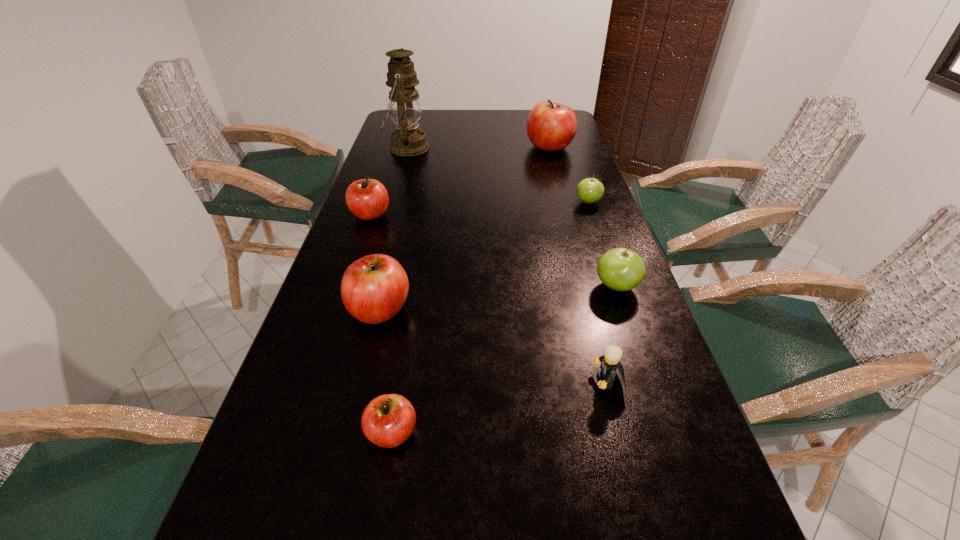
At what (x,y) coordinates should I click in order to perform the action: click on free spot between the Lego and the second smallest red apple. Please return your answer as a coordinate pair (x, y). Looking at the image, I should click on (x=489, y=298).

This screenshot has width=960, height=540. Find the location of `free spot between the oil lamp and the second farthest red apple`. free spot between the oil lamp and the second farthest red apple is located at coordinates (389, 181).

The height and width of the screenshot is (540, 960). In order to click on free spot between the Lego and the smallest red apple in this screenshot , I will do `click(500, 407)`.

Where is `free spot between the farther green apple and the rightmost red apple`? free spot between the farther green apple and the rightmost red apple is located at coordinates (568, 174).

Identify which object is the second closest to the third nearest red apple. Please provide its 2D coordinates. Your answer should be formatted as a tuple, i.e. [(x, y)], where the tuple contains the x and y coordinates of a point satisfying the conditions above.

[(404, 102)]

This screenshot has height=540, width=960. I want to click on the fifth closest object to the nearer green apple, so click(x=367, y=199).

At what (x,y) coordinates should I click in order to perform the action: click on apple that is the closest to the green oil lamp. Please return your answer as a coordinate pair (x, y). Looking at the image, I should click on (367, 199).

Select which apple appears as the second closest to the fifth shortest apple. Please provide its 2D coordinates. Your answer should be formatted as a tuple, i.e. [(x, y)], where the tuple contains the x and y coordinates of a point satisfying the conditions above.

[(367, 199)]

Point out which red apple is positioned as the nearest to the oil lamp. Please provide its 2D coordinates. Your answer should be formatted as a tuple, i.e. [(x, y)], where the tuple contains the x and y coordinates of a point satisfying the conditions above.

[(367, 199)]

Find the location of a particular element. red apple object that ranks as the closest to the third farthest red apple is located at coordinates (387, 421).